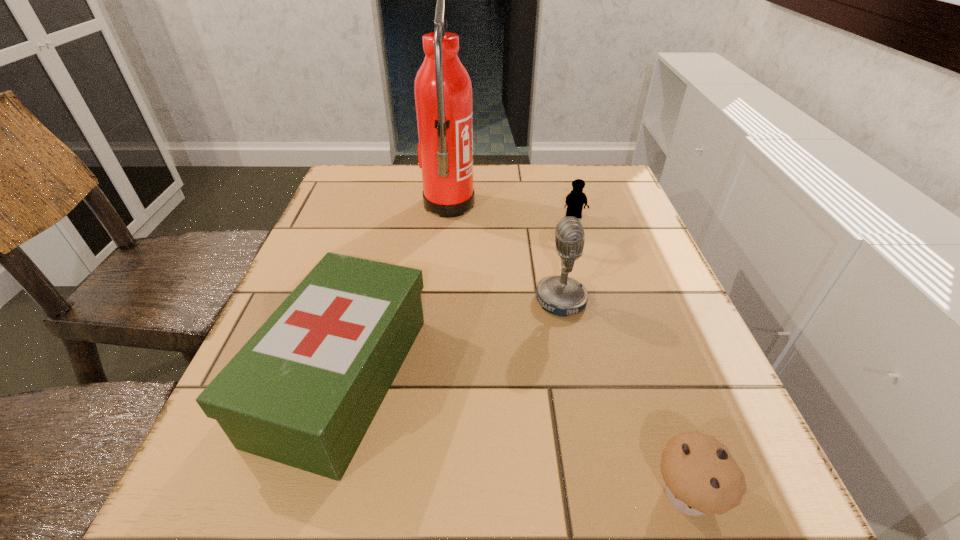
At what (x,y) coordinates should I click in order to perform the action: click on free space that satisfies the following two spatial constraints: 1. on the front-facing side of the muffin; 2. on the right side of the Lego. Please return your answer as a coordinate pair (x, y). Looking at the image, I should click on (654, 494).

I want to click on vacant position in the image that satisfies the following two spatial constraints: 1. on the front side of the third tallest object; 2. on the right side of the muffin, so click(x=309, y=494).

This screenshot has width=960, height=540. Find the location of `free space that satisfies the following two spatial constraints: 1. on the front-facing side of the muffin; 2. on the left side of the Lego`. free space that satisfies the following two spatial constraints: 1. on the front-facing side of the muffin; 2. on the left side of the Lego is located at coordinates (654, 494).